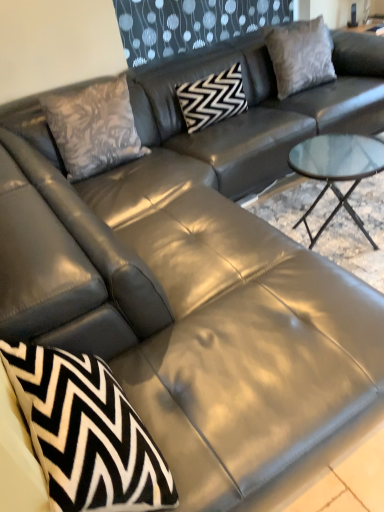
What is the approximate width of black and white zigzag pillow at lower left, which appears as the 2th throw pillow when viewed from the back?

black and white zigzag pillow at lower left, which appears as the 2th throw pillow when viewed from the back, is 10.53 inches in width.

Locate an element on the screen. floral-patterned fabric pillow at upper left, the 2th throw pillow in the bottom-to-top sequence is located at coordinates (93, 128).

Does point (196, 106) lie behind point (66, 168)?

Yes.

How many degrees apart are the facing directions of black zigzag-patterned pillow at center, which ranks as the 2th pillow in right-to-left order, and floral-patterned fabric pillow at upper left, the 2th throw pillow in the bottom-to-top sequence?

There is a 0.000833-degree angle between the facing directions of black zigzag-patterned pillow at center, which ranks as the 2th pillow in right-to-left order, and floral-patterned fabric pillow at upper left, the 2th throw pillow in the bottom-to-top sequence.

Could you tell me if black zigzag-patterned pillow at center, arranged as the 1th pillow when viewed from the left, is facing floral-patterned fabric pillow at upper left, the first throw pillow viewed from the back?

No, black zigzag-patterned pillow at center, arranged as the 1th pillow when viewed from the left, is not oriented towards floral-patterned fabric pillow at upper left, the first throw pillow viewed from the back.

Considering the sizes of objects black zigzag-patterned pillow at center, which ranks as the 2th pillow in right-to-left order, and floral-patterned fabric pillow at upper left, which is the second throw pillow from front to back, in the image provided, who is bigger, black zigzag-patterned pillow at center, which ranks as the 2th pillow in right-to-left order, or floral-patterned fabric pillow at upper left, which is the second throw pillow from front to back,?

floral-patterned fabric pillow at upper left, which is the second throw pillow from front to back, is bigger.

Between black zigzag-patterned pillow at center, arranged as the 1th pillow when viewed from the left, and suede gray pillow at upper right, the 1th pillow in the right-to-left sequence, which one has more height?

suede gray pillow at upper right, the 1th pillow in the right-to-left sequence, is taller.

Which of these two, black zigzag-patterned pillow at center, arranged as the 1th pillow when viewed from the left, or suede gray pillow at upper right, marked as the second pillow in a left-to-right arrangement, is bigger?

suede gray pillow at upper right, marked as the second pillow in a left-to-right arrangement, is bigger.

From a real-world perspective, between black zigzag-patterned pillow at center, arranged as the 1th pillow when viewed from the left, and suede gray pillow at upper right, the 1th pillow in the right-to-left sequence, who is vertically lower?

black zigzag-patterned pillow at center, arranged as the 1th pillow when viewed from the left, from a real-world perspective.

From a real-world perspective, between suede gray pillow at upper right, marked as the second pillow in a left-to-right arrangement, and floral-patterned fabric pillow at upper left, the first throw pillow viewed from the back, who is vertically higher?

In real-world perspective, suede gray pillow at upper right, marked as the second pillow in a left-to-right arrangement, is above.

Is suede gray pillow at upper right, marked as the second pillow in a left-to-right arrangement, surrounding floral-patterned fabric pillow at upper left, the 2th throw pillow in the bottom-to-top sequence?

No, suede gray pillow at upper right, marked as the second pillow in a left-to-right arrangement, does not contain floral-patterned fabric pillow at upper left, the 2th throw pillow in the bottom-to-top sequence.

At what (x,y) coordinates should I click in order to perform the action: click on the 1st throw pillow located beneath the suede gray pillow at upper right, the 1th pillow in the right-to-left sequence (from a real-world perspective). Please return your answer as a coordinate pair (x, y). Looking at the image, I should click on (93, 128).

Find the location of a particular element. This screenshot has width=384, height=512. the 2nd throw pillow in front when counting from the suede gray pillow at upper right, the 1th pillow in the right-to-left sequence is located at coordinates (86, 433).

Is black and white zigzag pillow at lower left, which is the first throw pillow in bottom-to-top order, at the right side of suede gray pillow at upper right, the 1th pillow in the right-to-left sequence?

Incorrect, black and white zigzag pillow at lower left, which is the first throw pillow in bottom-to-top order, is not on the right side of suede gray pillow at upper right, the 1th pillow in the right-to-left sequence.

Does black and white zigzag pillow at lower left, which appears as the 2th throw pillow when viewed from the back, have a lesser width compared to suede gray pillow at upper right, marked as the second pillow in a left-to-right arrangement?

No, black and white zigzag pillow at lower left, which appears as the 2th throw pillow when viewed from the back, is not thinner than suede gray pillow at upper right, marked as the second pillow in a left-to-right arrangement.

Consider the image. Can you confirm if black and white zigzag pillow at lower left, the second throw pillow from the top, is taller than suede gray pillow at upper right, the 1th pillow in the right-to-left sequence?

No, black and white zigzag pillow at lower left, the second throw pillow from the top, is not taller than suede gray pillow at upper right, the 1th pillow in the right-to-left sequence.

Is floral-patterned fabric pillow at upper left, the first throw pillow viewed from the back, to the left of black and white zigzag pillow at lower left, which ranks as the first throw pillow in front-to-back order, from the viewer's perspective?

Yes, floral-patterned fabric pillow at upper left, the first throw pillow viewed from the back, is to the left of black and white zigzag pillow at lower left, which ranks as the first throw pillow in front-to-back order.

From the image's perspective, which object appears higher, floral-patterned fabric pillow at upper left, which is the second throw pillow from front to back, or black and white zigzag pillow at lower left, which is the first throw pillow in bottom-to-top order?

floral-patterned fabric pillow at upper left, which is the second throw pillow from front to back.

Can you confirm if floral-patterned fabric pillow at upper left, which ranks as the 1th throw pillow in top-to-bottom order, is bigger than black and white zigzag pillow at lower left, which is the first throw pillow in bottom-to-top order?

Yes.

Between suede gray pillow at upper right, the 1th pillow in the right-to-left sequence, and black and white zigzag pillow at lower left, which is the first throw pillow in bottom-to-top order, which one has larger width?

black and white zigzag pillow at lower left, which is the first throw pillow in bottom-to-top order, is wider.

Is point (322, 42) positioned behind point (171, 497)?

Yes, point (322, 42) is behind point (171, 497).

From the image's perspective, does suede gray pillow at upper right, marked as the second pillow in a left-to-right arrangement, appear higher than black and white zigzag pillow at lower left, the second throw pillow from the top?

Yes, from the image's perspective, suede gray pillow at upper right, marked as the second pillow in a left-to-right arrangement, is above black and white zigzag pillow at lower left, the second throw pillow from the top.

Is point (229, 85) farther from camera compared to point (160, 471)?

Yes, point (229, 85) is farther from viewer.

From a real-world perspective, is black zigzag-patterned pillow at center, which ranks as the 2th pillow in right-to-left order, positioned under black and white zigzag pillow at lower left, which appears as the 2th throw pillow when viewed from the back, based on gravity?

Indeed, from a real-world perspective, black zigzag-patterned pillow at center, which ranks as the 2th pillow in right-to-left order, is positioned beneath black and white zigzag pillow at lower left, which appears as the 2th throw pillow when viewed from the back.

Which object is positioned more to the left, black zigzag-patterned pillow at center, arranged as the 1th pillow when viewed from the left, or black and white zigzag pillow at lower left, the second throw pillow from the top?

black and white zigzag pillow at lower left, the second throw pillow from the top.

There is a black zigzag-patterned pillow at center, which ranks as the 2th pillow in right-to-left order. Where is `the 2nd throw pillow above it (from a real-world perspective)`? the 2nd throw pillow above it (from a real-world perspective) is located at coordinates (93, 128).

Where is `pillow in front of the suede gray pillow at upper right, the 1th pillow in the right-to-left sequence`? This screenshot has height=512, width=384. pillow in front of the suede gray pillow at upper right, the 1th pillow in the right-to-left sequence is located at coordinates (212, 98).

Which object lies further to the anchor point floral-patterned fabric pillow at upper left, the 2th throw pillow in the bottom-to-top sequence, black zigzag-patterned pillow at center, which ranks as the 2th pillow in right-to-left order, or black and white zigzag pillow at lower left, the second throw pillow from the top?

black and white zigzag pillow at lower left, the second throw pillow from the top, is positioned further to the anchor floral-patterned fabric pillow at upper left, the 2th throw pillow in the bottom-to-top sequence.

Based on their spatial positions, is floral-patterned fabric pillow at upper left, which is the second throw pillow from front to back, or suede gray pillow at upper right, marked as the second pillow in a left-to-right arrangement, closer to black and white zigzag pillow at lower left, the second throw pillow from the top?

Among the two, floral-patterned fabric pillow at upper left, which is the second throw pillow from front to back, is located nearer to black and white zigzag pillow at lower left, the second throw pillow from the top.

From the image, which object appears to be farther from floral-patterned fabric pillow at upper left, which ranks as the 1th throw pillow in top-to-bottom order, black and white zigzag pillow at lower left, which is the first throw pillow in bottom-to-top order, or suede gray pillow at upper right, the 1th pillow in the right-to-left sequence?

Among the two, black and white zigzag pillow at lower left, which is the first throw pillow in bottom-to-top order, is located further to floral-patterned fabric pillow at upper left, which ranks as the 1th throw pillow in top-to-bottom order.

Which object lies further to the anchor point black and white zigzag pillow at lower left, which ranks as the first throw pillow in front-to-back order, suede gray pillow at upper right, the 1th pillow in the right-to-left sequence, or floral-patterned fabric pillow at upper left, which ranks as the 1th throw pillow in top-to-bottom order?

suede gray pillow at upper right, the 1th pillow in the right-to-left sequence, lies further to black and white zigzag pillow at lower left, which ranks as the first throw pillow in front-to-back order, than the other object.

Estimate the real-world distances between objects in this image. Which object is closer to floral-patterned fabric pillow at upper left, which is the second throw pillow from front to back, suede gray pillow at upper right, marked as the second pillow in a left-to-right arrangement, or black zigzag-patterned pillow at center, which ranks as the 2th pillow in right-to-left order?

black zigzag-patterned pillow at center, which ranks as the 2th pillow in right-to-left order.

Estimate the real-world distances between objects in this image. Which object is further from suede gray pillow at upper right, the 1th pillow in the right-to-left sequence, black and white zigzag pillow at lower left, which ranks as the first throw pillow in front-to-back order, or black zigzag-patterned pillow at center, which ranks as the 2th pillow in right-to-left order?

black and white zigzag pillow at lower left, which ranks as the first throw pillow in front-to-back order.

When comparing their distances from black zigzag-patterned pillow at center, arranged as the 1th pillow when viewed from the left, does black and white zigzag pillow at lower left, the second throw pillow from the top, or suede gray pillow at upper right, marked as the second pillow in a left-to-right arrangement, seem closer?

Among the two, suede gray pillow at upper right, marked as the second pillow in a left-to-right arrangement, is located nearer to black zigzag-patterned pillow at center, arranged as the 1th pillow when viewed from the left.

Which object lies further to the anchor point floral-patterned fabric pillow at upper left, which ranks as the 1th throw pillow in top-to-bottom order, black zigzag-patterned pillow at center, arranged as the 1th pillow when viewed from the left, or suede gray pillow at upper right, marked as the second pillow in a left-to-right arrangement?

suede gray pillow at upper right, marked as the second pillow in a left-to-right arrangement.

What are the coordinates of `throw pillow between black and white zigzag pillow at lower left, which appears as the 2th throw pillow when viewed from the back, and suede gray pillow at upper right, marked as the second pillow in a left-to-right arrangement, along the z-axis` in the screenshot? It's located at (93, 128).

Where is `pillow between black and white zigzag pillow at lower left, which ranks as the first throw pillow in front-to-back order, and suede gray pillow at upper right, the 1th pillow in the right-to-left sequence, along the z-axis`? pillow between black and white zigzag pillow at lower left, which ranks as the first throw pillow in front-to-back order, and suede gray pillow at upper right, the 1th pillow in the right-to-left sequence, along the z-axis is located at coordinates (212, 98).

This screenshot has height=512, width=384. I want to click on throw pillow located between black and white zigzag pillow at lower left, which is the first throw pillow in bottom-to-top order, and black zigzag-patterned pillow at center, which ranks as the 2th pillow in right-to-left order, in the depth direction, so point(93,128).

Locate an element on the screen. pillow between floral-patterned fabric pillow at upper left, the first throw pillow viewed from the back, and suede gray pillow at upper right, the 1th pillow in the right-to-left sequence, from left to right is located at coordinates 212,98.